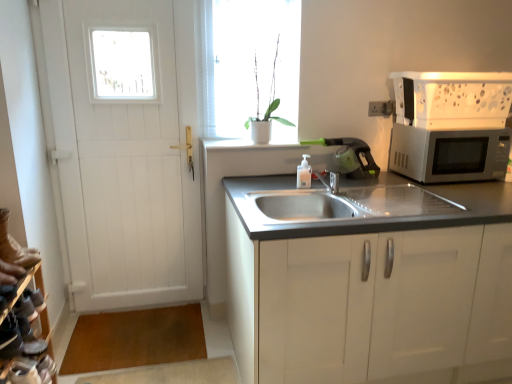
Question: Is white wooden door at left at the left side of white matte pot at upper center?

Choices:
 (A) no
 (B) yes

Answer: (B)

Question: Is white wooden door at left bigger than white matte pot at upper center?

Choices:
 (A) no
 (B) yes

Answer: (B)

Question: Is white wooden door at left looking in the opposite direction of white matte pot at upper center?

Choices:
 (A) no
 (B) yes

Answer: (A)

Question: Is white wooden door at left to the right of white matte pot at upper center from the viewer's perspective?

Choices:
 (A) no
 (B) yes

Answer: (A)

Question: Is white wooden door at left in front of white matte pot at upper center?

Choices:
 (A) yes
 (B) no

Answer: (A)

Question: Considering the relative sizes of white wooden door at left and white matte pot at upper center in the image provided, is white wooden door at left wider than white matte pot at upper center?

Choices:
 (A) yes
 (B) no

Answer: (B)

Question: Considering the relative sizes of white matte pot at upper center and white matte plant at upper center in the image provided, is white matte pot at upper center bigger than white matte plant at upper center?

Choices:
 (A) yes
 (B) no

Answer: (A)

Question: Considering the relative positions of white matte pot at upper center and white matte plant at upper center in the image provided, is white matte pot at upper center to the left of white matte plant at upper center from the viewer's perspective?

Choices:
 (A) no
 (B) yes

Answer: (A)

Question: Does white matte pot at upper center appear on the right side of white matte plant at upper center?

Choices:
 (A) yes
 (B) no

Answer: (A)

Question: From the image's perspective, is white matte pot at upper center above white matte plant at upper center?

Choices:
 (A) yes
 (B) no

Answer: (B)

Question: Does white matte pot at upper center come behind white matte plant at upper center?

Choices:
 (A) yes
 (B) no

Answer: (B)

Question: Considering the relative sizes of white matte pot at upper center and white matte plant at upper center in the image provided, is white matte pot at upper center shorter than white matte plant at upper center?

Choices:
 (A) yes
 (B) no

Answer: (A)

Question: Is white smooth window sill at upper center aimed at silver metallic microwave at right?

Choices:
 (A) no
 (B) yes

Answer: (A)